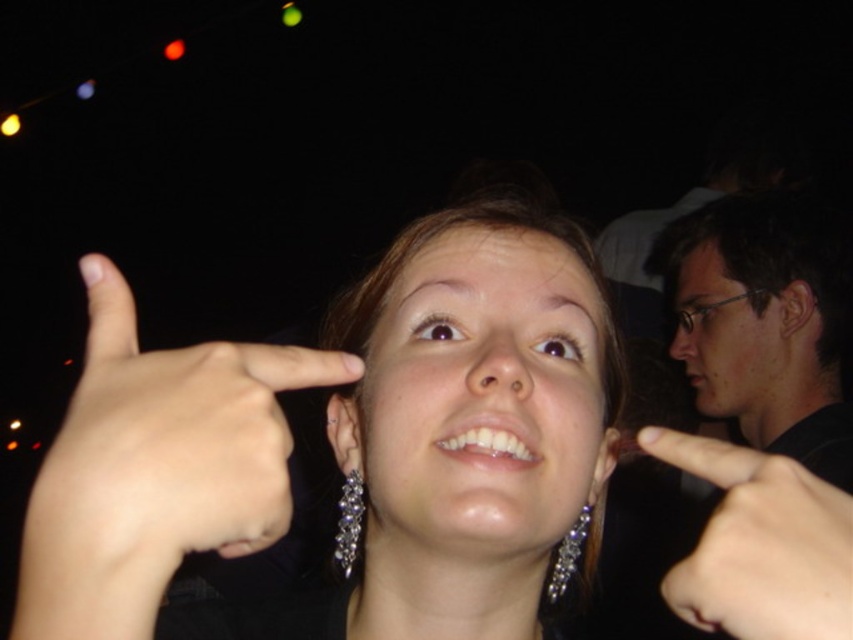
Question: Which point is farther from the camera taking this photo?

Choices:
 (A) (440, 324)
 (B) (581, 541)

Answer: (B)

Question: Which of these objects is positioned farthest from the silver metallic earrings at center?

Choices:
 (A) silver/glassy earrings at lower center
 (B) silver metallic ring at upper left

Answer: (A)

Question: Is black matte glasses at upper right smaller than skinny flesh-colored finger at upper right?

Choices:
 (A) yes
 (B) no

Answer: (B)

Question: In this image, where is silver metallic earrings at center located relative to silver metallic ring at upper left?

Choices:
 (A) left
 (B) right

Answer: (B)

Question: Estimate the real-world distances between objects in this image. Which object is farther from the skinny flesh-colored finger at upper right?

Choices:
 (A) silver/glassy earrings at lower center
 (B) silver metallic earrings at lower center
 (C) silver metallic ring at upper left

Answer: (B)

Question: Is silver metallic earrings at center bigger than silver metallic ring at upper left?

Choices:
 (A) yes
 (B) no

Answer: (A)